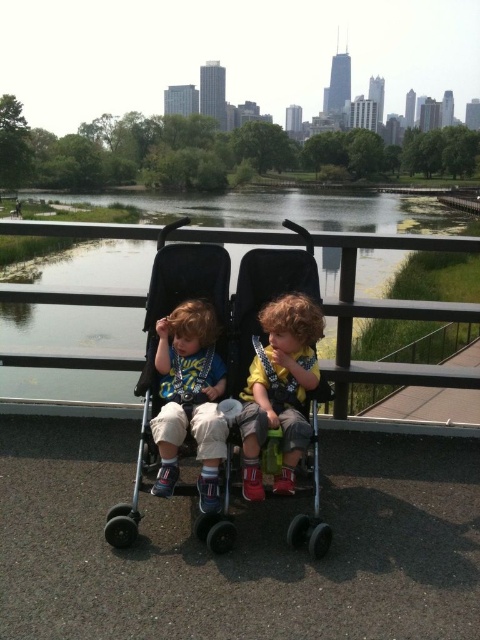
Looking at this image, you are a delivery drone that needs to land on the paved pathway near the railing overlooking the water. The black plastic stroller at center is in your path. Can you safely land in the area without hitting the stroller?

The black plastic stroller at center is located at point (219, 332), so you need to avoid that coordinate to land safely in the clear area of the pathway.

You are a parent pushing the double stroller with the two children. You want to ensure the stroller doesn not get stuck. Considering the green grass at lower center and the matte blue shirt at center, which surface is higher and could potentially block the stroller?

The green grass at lower center has a greater height compared to the matte blue shirt at center, so the green grass at lower center could potentially block the stroller.